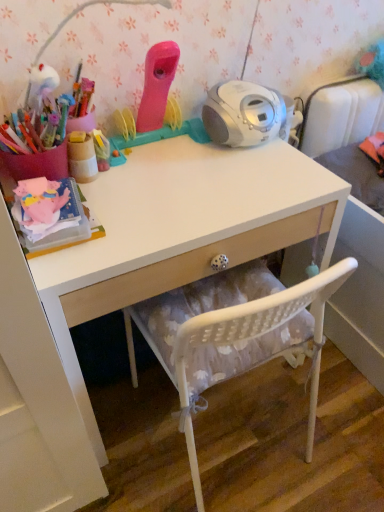
Find the location of a particular element. Image resolution: width=384 pixels, height=512 pixels. free space above white glossy desk at center (from a real-world perspective) is located at coordinates (182, 179).